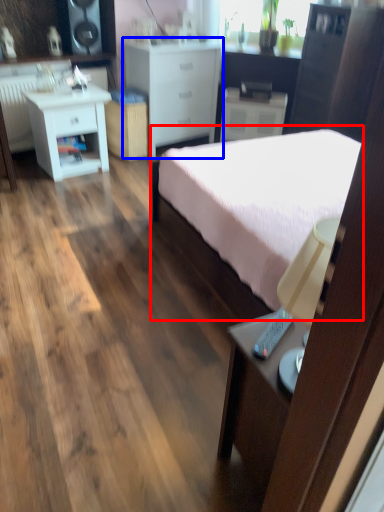
Question: Which of the following is the closest to the observer, bed (highlighted by a red box) or chest of drawers (highlighted by a blue box)?

Choices:
 (A) bed
 (B) chest of drawers

Answer: (A)